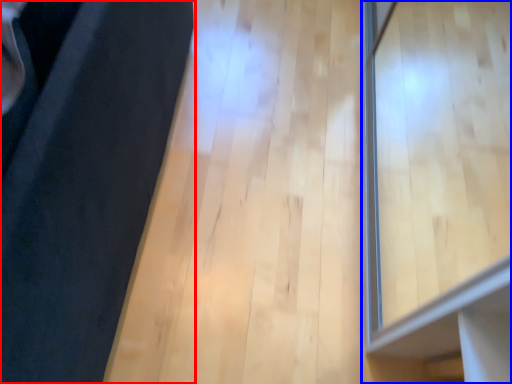
Question: Which object appears farthest to the camera in this image, furniture (highlighted by a red box) or window (highlighted by a blue box)?

Choices:
 (A) furniture
 (B) window

Answer: (B)